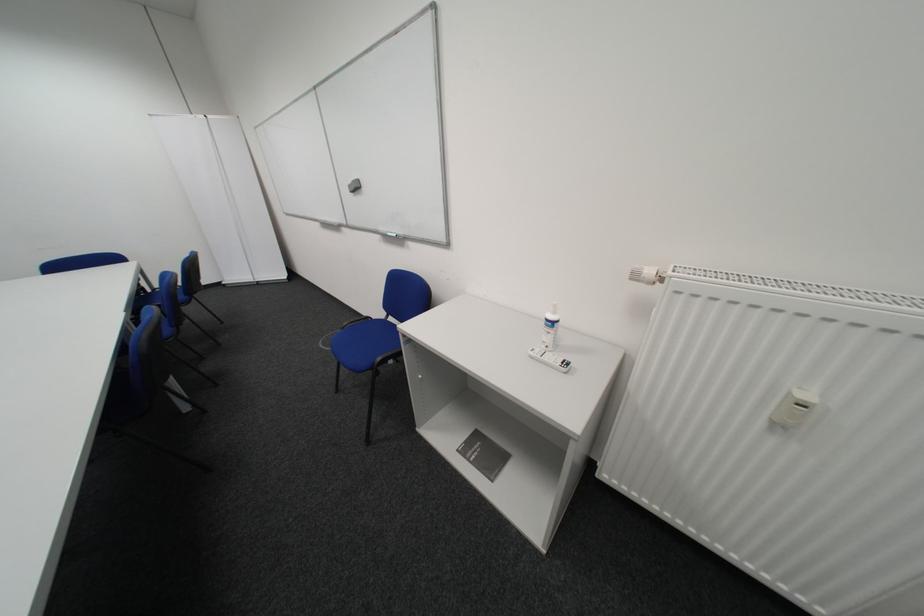
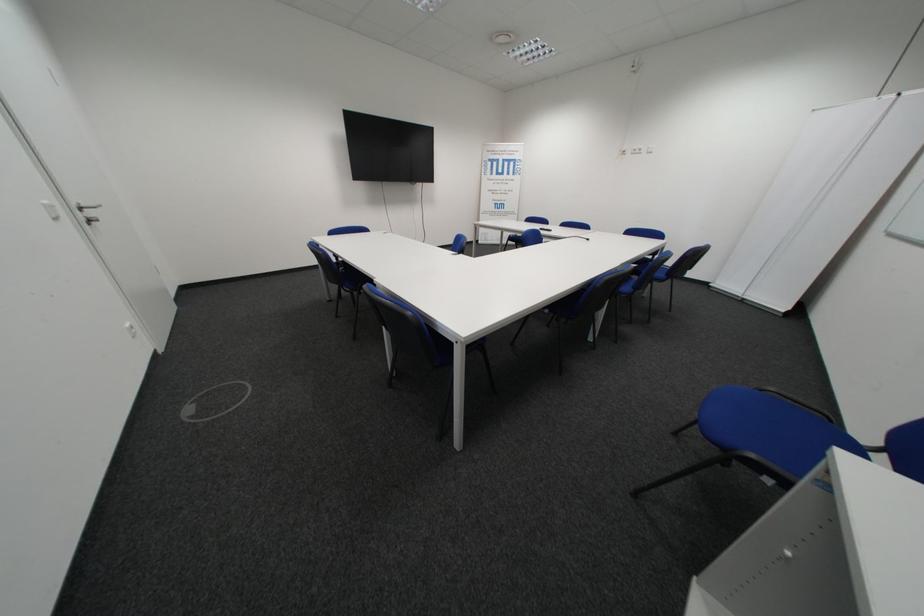
The images are taken continuously from a first-person perspective. In which direction is your viewpoint rotating?

The camera's rotation is toward left-down.